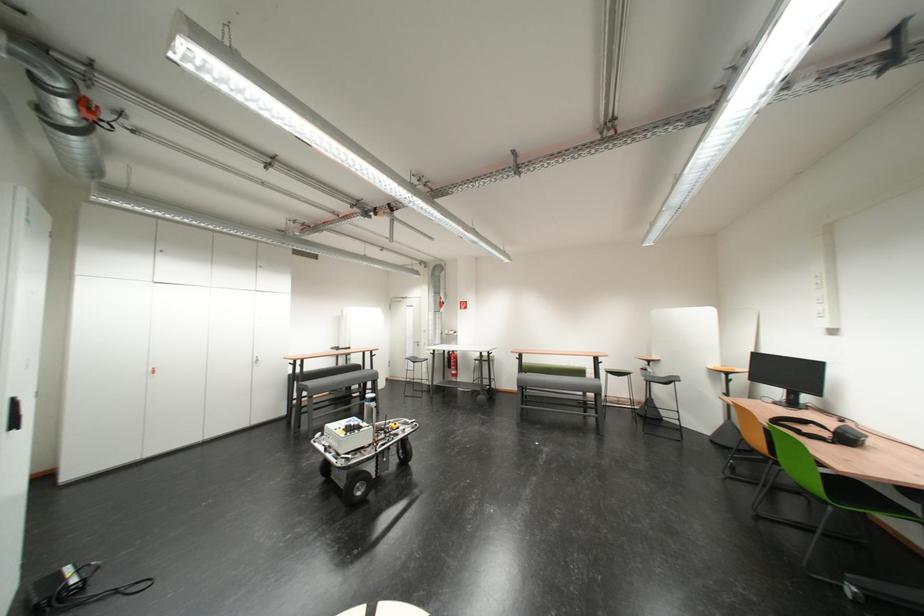
Find the location of a particular element. robot cart handle is located at coordinates (329, 453).